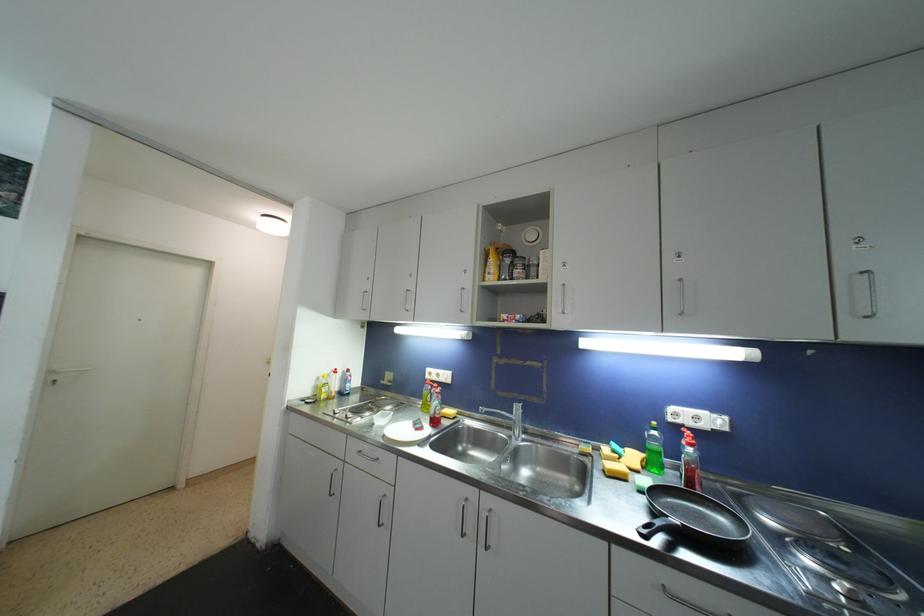
The location [322,387] corresponds to which object?

This point indicates the yellow soap bottle.